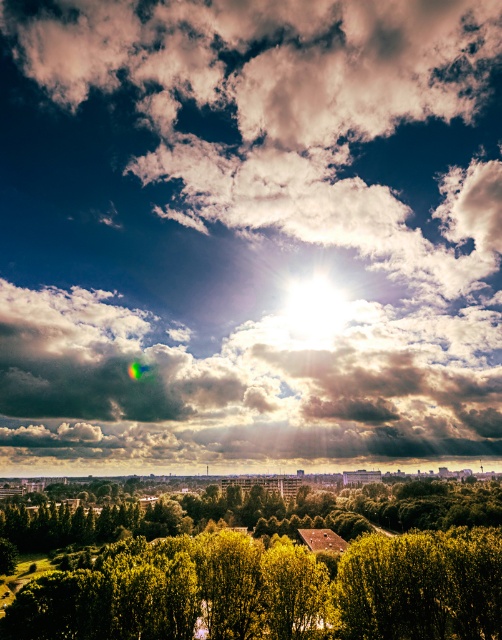
You are standing in the landscape looking at the sky scene. There is a point at coordinates point (x=238, y=211). Can you estimate how far this point is from you in feet?

The point (x=238, y=211) is 829.74 feet away from the viewer.

You are a bird flying in the sky scene. You want to fly under the bright white clouds at upper center and above the green leafy tree at center. Is this possible?

The bright white clouds at upper center is much taller than the green leafy tree at center, so yes, you can fly under the bright white clouds at upper center and above the green leafy tree at center.

You are a bird flying at an altitude of 500 feet. You see the bright white clouds at upper center and the green leafy tree at center. Can you safely descend to land on the tree without hitting the clouds?

The bright white clouds at upper center and green leafy tree at center are 478.99 feet apart. Since you are flying at 500 feet, descending to the tree would require descending below the clouds. However, the vertical distance between the clouds and the tree is 478.99 feet, so you have enough space to safely descend without hitting the clouds as long as you navigate carefully.